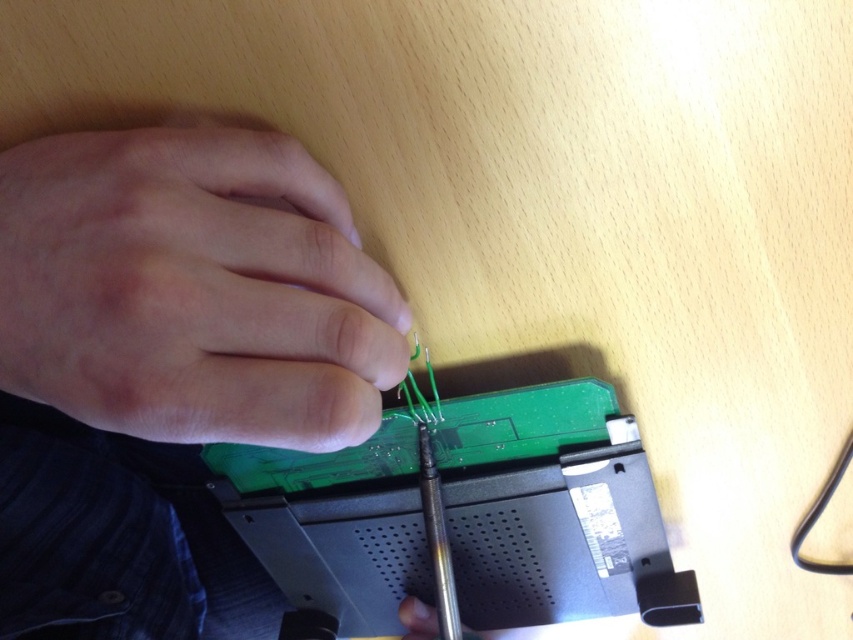
Looking at this image, what is located at the coordinates point (192, 289) in the image?

The point (192, 289) corresponds to the skinny white hand at upper left.

You are a technician trying to fix a device. You see the skinny white hand at upper left and the matte black hand at center. Which hand is positioned higher in the image?

The skinny white hand at upper left is positioned higher than the matte black hand at center.

Where is the skinny white hand at upper left located in the image?

The skinny white hand at upper left is located at point (x=192, y=289).